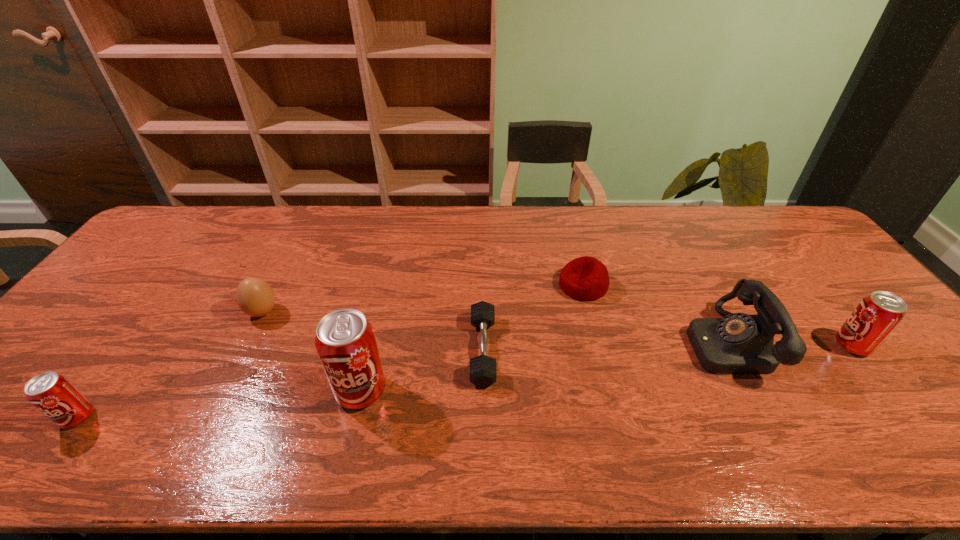
You are a GUI agent. You are given a task and a screenshot of the screen. Output one action in this format:
    pyautogui.click(x=<x>, y=<y>)
    Task: Click on the free space at the far left corner of the desktop
    The image size is (960, 540).
    Given the screenshot: What is the action you would take?
    pyautogui.click(x=213, y=219)

Identify the location of vacant space at the near left corner of the desktop. (21, 404).

Locate an element on the screen. free region at the near right corner is located at coordinates (910, 414).

Where is `free point between the rightmost soda and the leftmost soda`? free point between the rightmost soda and the leftmost soda is located at coordinates (465, 382).

Where is `unoccupied area between the farthest soda and the shortest object`? Image resolution: width=960 pixels, height=540 pixels. unoccupied area between the farthest soda and the shortest object is located at coordinates (667, 348).

Locate an element on the screen. Image resolution: width=960 pixels, height=540 pixels. vacant area between the third object from right to left and the second object from left to right is located at coordinates pos(422,299).

This screenshot has height=540, width=960. What are the coordinates of `blank region between the leftmost object and the tallest soda` in the screenshot? It's located at (220, 404).

Locate an element on the screen. The image size is (960, 540). empty space that is in between the beanbag and the boiled egg is located at coordinates (422, 299).

This screenshot has width=960, height=540. I want to click on free space between the second object from right to left and the leftmost object, so click(x=402, y=380).

The width and height of the screenshot is (960, 540). I want to click on free point between the beanbag and the rightmost soda, so click(x=717, y=315).